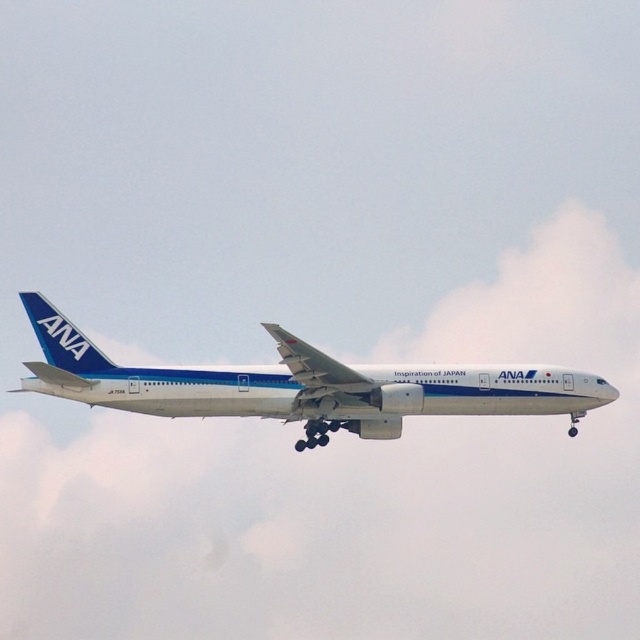
Which is more to the right, white fluffy cloud at upper center or white glossy airplane at center?

white glossy airplane at center is more to the right.

Does point (316, 497) lie in front of point (45, 317)?

No, it is behind (45, 317).

I want to click on white fluffy cloud at upper center, so click(355, 493).